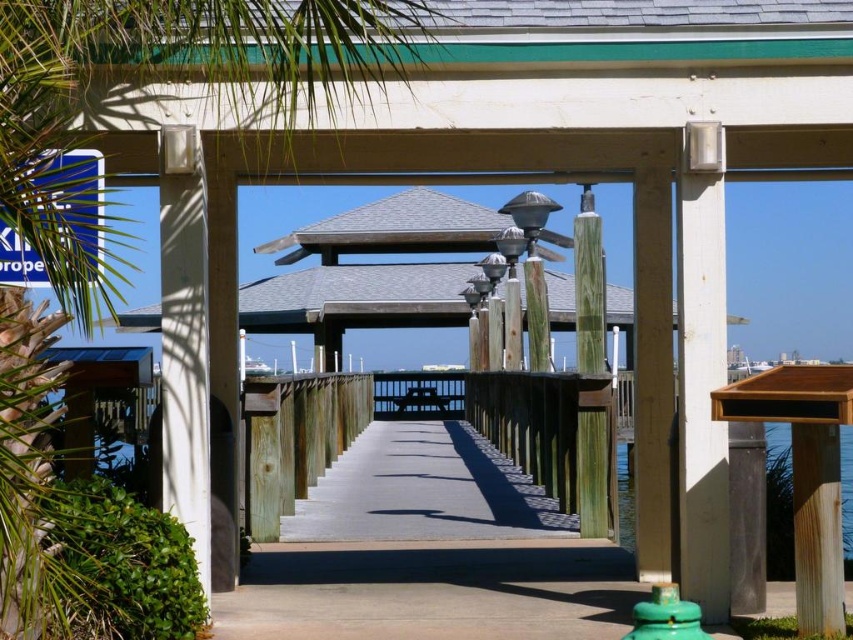
Question: Which point is closer to the camera?

Choices:
 (A) green leafy palm tree at left
 (B) green matte hydrant at lower center

Answer: (A)

Question: Which of the following is the closest to the observer?

Choices:
 (A) green matte hydrant at lower center
 (B) green weathered wood post at center
 (C) green leafy palm tree at left

Answer: (C)

Question: Among these points, which one is nearest to the camera?

Choices:
 (A) (598, 291)
 (B) (670, 627)
 (C) (189, 451)

Answer: (B)

Question: Does white wood post at center have a greater width compared to clear wood water at center?

Choices:
 (A) no
 (B) yes

Answer: (A)

Question: Is white wood post at center to the right of green weathered wood post at center from the viewer's perspective?

Choices:
 (A) no
 (B) yes

Answer: (A)

Question: Is white wood post at center smaller than green matte hydrant at lower center?

Choices:
 (A) no
 (B) yes

Answer: (A)